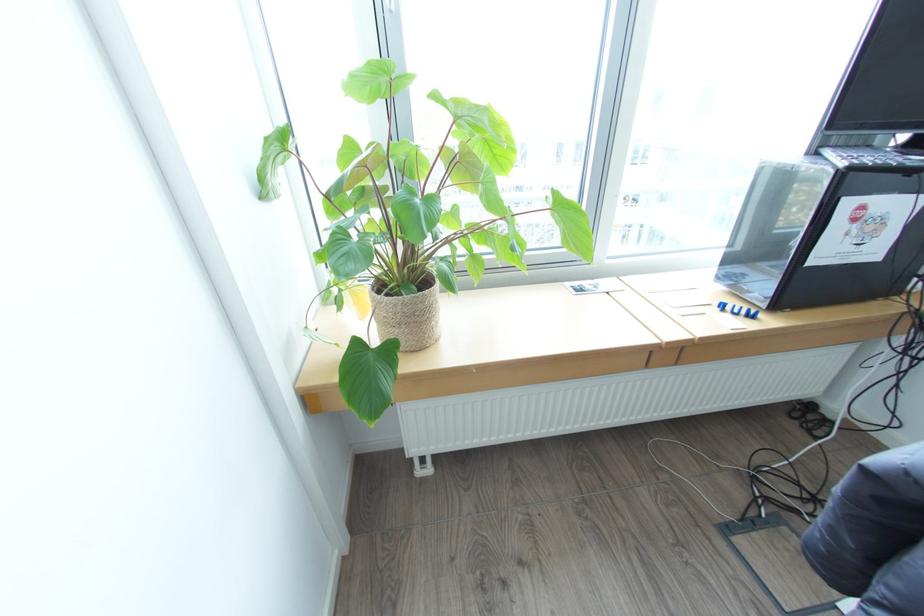
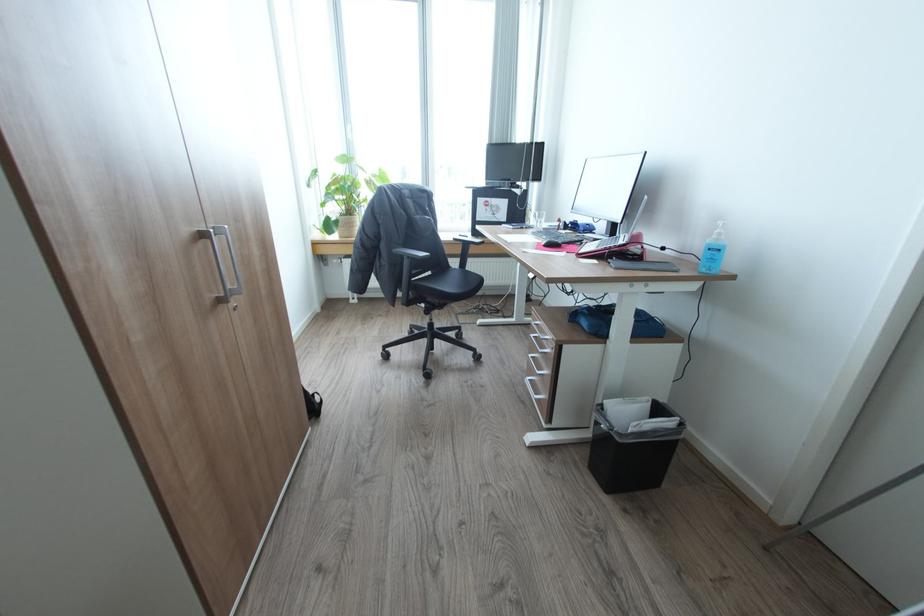
What movement of the cameraman would produce the second image?

The cameraman walked toward right, backward.